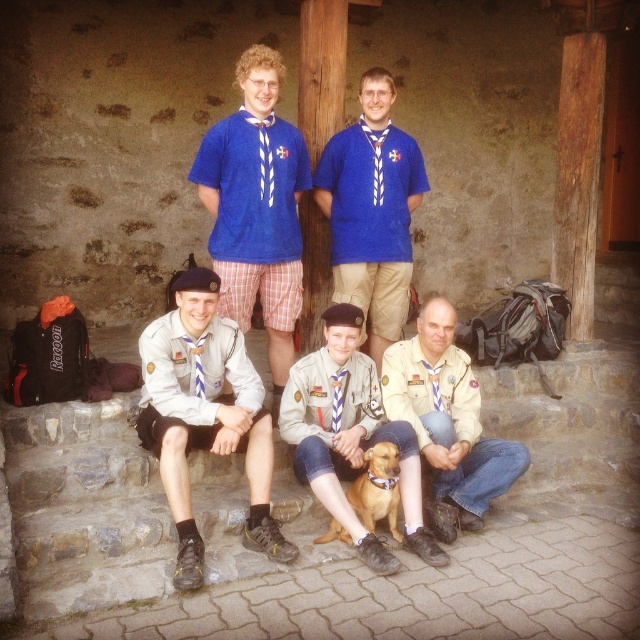
Who is positioned more to the right, blue woven fabric shirt at upper center or brown leather dog at center?

brown leather dog at center is more to the right.

Is blue woven fabric shirt at upper center to the left of brown leather dog at center from the viewer's perspective?

Yes, blue woven fabric shirt at upper center is to the left of brown leather dog at center.

You are a GUI agent. You are given a task and a screenshot of the screen. Output one action in this format:
    pyautogui.click(x=<x>, y=<y>)
    Task: Click on the blue woven fabric shirt at upper center
    
    Given the screenshot: What is the action you would take?
    pyautogui.click(x=257, y=209)

Where is `blue woven fabric shirt at upper center`? The height and width of the screenshot is (640, 640). blue woven fabric shirt at upper center is located at coordinates (257, 209).

Consider the image. Does light brown uniform at lower left appear on the right side of light brown uniform at center?

No, light brown uniform at lower left is not to the right of light brown uniform at center.

You are a GUI agent. You are given a task and a screenshot of the screen. Output one action in this format:
    pyautogui.click(x=<x>, y=<y>)
    Task: Click on the light brown uniform at lower left
    The height and width of the screenshot is (640, 640).
    Given the screenshot: What is the action you would take?
    204,416

This screenshot has width=640, height=640. What do you see at coordinates (204, 416) in the screenshot?
I see `light brown uniform at lower left` at bounding box center [204, 416].

Where is `light brown uniform at lower left`? This screenshot has height=640, width=640. light brown uniform at lower left is located at coordinates (204, 416).

Between light brown uniform at center and brown leather dog at center, which one has less height?

brown leather dog at center is shorter.

Is light brown uniform at center above brown leather dog at center?

Yes, light brown uniform at center is above brown leather dog at center.

You are a GUI agent. You are given a task and a screenshot of the screen. Output one action in this format:
    pyautogui.click(x=<x>, y=<y>)
    Task: Click on the light brown uniform at center
    
    Given the screenshot: What is the action you would take?
    pyautogui.click(x=349, y=436)

You are a GUI agent. You are given a task and a screenshot of the screen. Output one action in this format:
    pyautogui.click(x=<x>, y=<y>)
    Task: Click on the light brown uniform at center
    
    Given the screenshot: What is the action you would take?
    [349, 436]